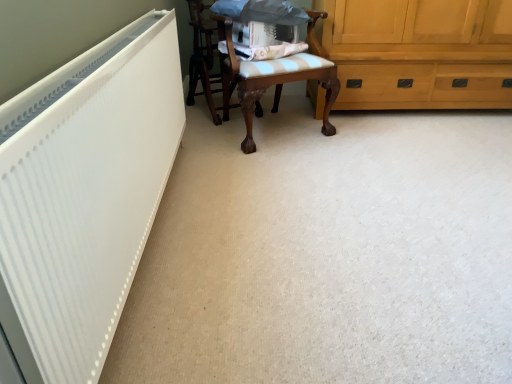
What is the approximate height of wooden chair with cushion at center, the first chair viewed from the left?

29.85 inches.

What are the coordinates of `wooden chair with striped cushion at center, which is the 2th chair in left-to-right order` in the screenshot? It's located at (274, 76).

The width and height of the screenshot is (512, 384). What do you see at coordinates (274, 76) in the screenshot?
I see `wooden chair with striped cushion at center, the 1th chair positioned from the right` at bounding box center [274, 76].

What do you see at coordinates (84, 194) in the screenshot?
I see `white matte radiator at left` at bounding box center [84, 194].

What are the coordinates of `light brown wood cabinet at right` in the screenshot? It's located at (420, 53).

Considering the relative sizes of wooden chair with striped cushion at center, the 1th chair positioned from the right, and wooden chair with cushion at center, which is the second chair from right to left, in the image provided, is wooden chair with striped cushion at center, the 1th chair positioned from the right, smaller than wooden chair with cushion at center, which is the second chair from right to left,?

Actually, wooden chair with striped cushion at center, the 1th chair positioned from the right, might be larger than wooden chair with cushion at center, which is the second chair from right to left.

This screenshot has height=384, width=512. Identify the location of chair below the wooden chair with striped cushion at center, the 1th chair positioned from the right (from a real-world perspective). (202, 57).

From the image's perspective, is wooden chair with striped cushion at center, which is the 2th chair in left-to-right order, over wooden chair with cushion at center, which is the second chair from right to left?

No, from the image's perspective, wooden chair with striped cushion at center, which is the 2th chair in left-to-right order, is not on top of wooden chair with cushion at center, which is the second chair from right to left.

How many degrees apart are the facing directions of wooden chair with striped cushion at center, which is the 2th chair in left-to-right order, and wooden chair with cushion at center, the first chair viewed from the left?

wooden chair with striped cushion at center, which is the 2th chair in left-to-right order, and wooden chair with cushion at center, the first chair viewed from the left, are facing 3.02 degrees away from each other.

Between wooden chair with striped cushion at center, the 1th chair positioned from the right, and light brown wood cabinet at right, which one has larger size?

With larger size is light brown wood cabinet at right.

Is wooden chair with striped cushion at center, the 1th chair positioned from the right, in front of light brown wood cabinet at right?

That is True.

Is point (194, 50) farther from viewer compared to point (314, 14)?

Yes, it is behind point (314, 14).

This screenshot has height=384, width=512. Identify the location of chair above the wooden chair with cushion at center, which is the second chair from right to left (from a real-world perspective). (274, 76).

In the scene shown: Would you say wooden chair with cushion at center, which is the second chair from right to left, is inside or outside wooden chair with striped cushion at center, which is the 2th chair in left-to-right order?

wooden chair with cushion at center, which is the second chair from right to left, is spatially situated outside wooden chair with striped cushion at center, which is the 2th chair in left-to-right order.

Is wooden chair with cushion at center, which is the second chair from right to left, at the right side of wooden chair with striped cushion at center, which is the 2th chair in left-to-right order?

No.

From the image's perspective, would you say wooden chair with striped cushion at center, the 1th chair positioned from the right, is shown under white matte radiator at left?

No, from the image's perspective, wooden chair with striped cushion at center, the 1th chair positioned from the right, is not below white matte radiator at left.

From a real-world perspective, is wooden chair with striped cushion at center, the 1th chair positioned from the right, physically below white matte radiator at left?

Incorrect, from a real-world perspective, wooden chair with striped cushion at center, the 1th chair positioned from the right, is higher than white matte radiator at left.

How many degrees apart are the facing directions of wooden chair with striped cushion at center, which is the 2th chair in left-to-right order, and white matte radiator at left?

The facing directions of wooden chair with striped cushion at center, which is the 2th chair in left-to-right order, and white matte radiator at left are 59.7 degrees apart.

Is wooden chair with striped cushion at center, which is the 2th chair in left-to-right order, to the right of white matte radiator at left from the viewer's perspective?

Correct, you'll find wooden chair with striped cushion at center, which is the 2th chair in left-to-right order, to the right of white matte radiator at left.

From a real-world perspective, who is located higher, light brown wood cabinet at right or wooden chair with cushion at center, which is the second chair from right to left?

In real-world perspective, wooden chair with cushion at center, which is the second chair from right to left, is above.

Who is shorter, light brown wood cabinet at right or wooden chair with cushion at center, the first chair viewed from the left?

With less height is light brown wood cabinet at right.

From a real-world perspective, count 1st chairs upward from the light brown wood cabinet at right and point to it. Please provide its 2D coordinates.

[(202, 57)]

Can you confirm if light brown wood cabinet at right is bigger than wooden chair with cushion at center, which is the second chair from right to left?

Yes.

Can you confirm if white matte radiator at left is positioned to the left of wooden chair with striped cushion at center, the 1th chair positioned from the right?

Yes.

Based on the photo, which is nearer, (36,307) or (303,73)?

Positioned in front is point (36,307).

Are white matte radiator at left and wooden chair with striped cushion at center, which is the 2th chair in left-to-right order, beside each other?

white matte radiator at left and wooden chair with striped cushion at center, which is the 2th chair in left-to-right order, are clearly separated.

Would you say wooden chair with striped cushion at center, which is the 2th chair in left-to-right order, is part of white matte radiator at left's contents?

Actually, wooden chair with striped cushion at center, which is the 2th chair in left-to-right order, is outside white matte radiator at left.

Based on the photo, from a real-world perspective, which is physically above, white matte radiator at left or light brown wood cabinet at right?

white matte radiator at left, from a real-world perspective.

Is white matte radiator at left not inside light brown wood cabinet at right?

Yes, white matte radiator at left is located beyond the bounds of light brown wood cabinet at right.

Which object is closer to the camera taking this photo, white matte radiator at left or light brown wood cabinet at right?

white matte radiator at left is in front.

Is white matte radiator at left taller than light brown wood cabinet at right?

Yes.

There is a wooden chair with cushion at center, which is the second chair from right to left. What are the coordinates of `chair above it (from a real-world perspective)` in the screenshot? It's located at (274, 76).

Where is `cabinetry beneath the wooden chair with striped cushion at center, the 1th chair positioned from the right (from a real-world perspective)`? The width and height of the screenshot is (512, 384). cabinetry beneath the wooden chair with striped cushion at center, the 1th chair positioned from the right (from a real-world perspective) is located at coordinates (420, 53).

Estimate the real-world distances between objects in this image. Which object is closer to light brown wood cabinet at right, wooden chair with cushion at center, which is the second chair from right to left, or white matte radiator at left?

The object closer to light brown wood cabinet at right is wooden chair with cushion at center, which is the second chair from right to left.

Looking at this image, which object lies further to the anchor point light brown wood cabinet at right, wooden chair with cushion at center, the first chair viewed from the left, or wooden chair with striped cushion at center, which is the 2th chair in left-to-right order?

wooden chair with cushion at center, the first chair viewed from the left, lies further to light brown wood cabinet at right than the other object.

When comparing their distances from white matte radiator at left, does light brown wood cabinet at right or wooden chair with cushion at center, the first chair viewed from the left, seem closer?

Among the two, wooden chair with cushion at center, the first chair viewed from the left, is located nearer to white matte radiator at left.

Estimate the real-world distances between objects in this image. Which object is closer to white matte radiator at left, wooden chair with cushion at center, the first chair viewed from the left, or light brown wood cabinet at right?

Based on the image, wooden chair with cushion at center, the first chair viewed from the left, appears to be nearer to white matte radiator at left.

Which object lies further to the anchor point light brown wood cabinet at right, white matte radiator at left or wooden chair with striped cushion at center, which is the 2th chair in left-to-right order?

white matte radiator at left.

Based on their spatial positions, is wooden chair with striped cushion at center, which is the 2th chair in left-to-right order, or wooden chair with cushion at center, which is the second chair from right to left, further from white matte radiator at left?

wooden chair with cushion at center, which is the second chair from right to left, is positioned further to the anchor white matte radiator at left.

Considering their positions, is wooden chair with striped cushion at center, the 1th chair positioned from the right, positioned closer to white matte radiator at left than light brown wood cabinet at right?

wooden chair with striped cushion at center, the 1th chair positioned from the right.

Which object lies further to the anchor point wooden chair with cushion at center, which is the second chair from right to left, white matte radiator at left or light brown wood cabinet at right?

Based on the image, white matte radiator at left appears to be further to wooden chair with cushion at center, which is the second chair from right to left.

The width and height of the screenshot is (512, 384). I want to click on chair between wooden chair with cushion at center, which is the second chair from right to left, and light brown wood cabinet at right from left to right, so click(x=274, y=76).

This screenshot has height=384, width=512. I want to click on chair between white matte radiator at left and wooden chair with cushion at center, the first chair viewed from the left, from front to back, so click(274, 76).